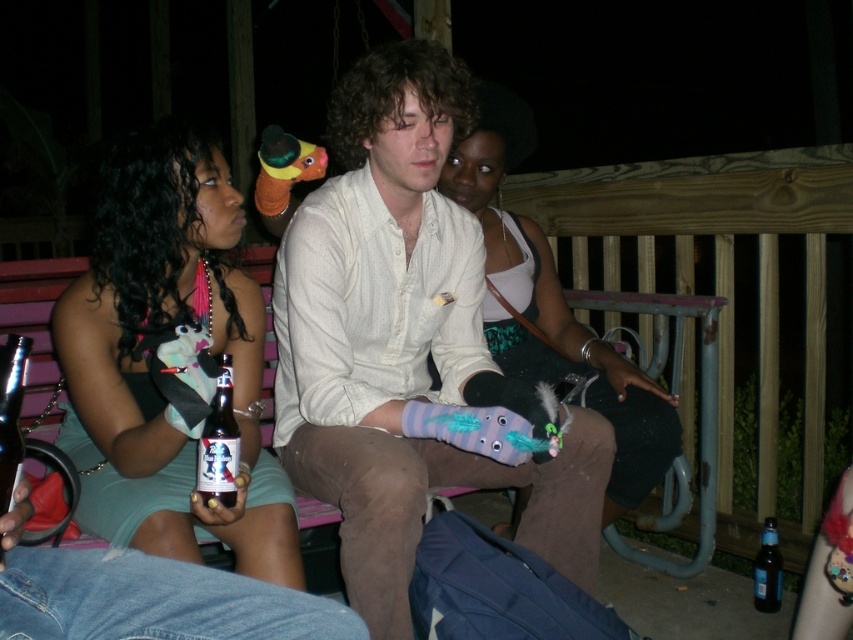
Question: Among these points, which one is farthest from the camera?

Choices:
 (A) (773, 611)
 (B) (563, 353)
 (C) (215, 465)

Answer: (B)

Question: Among these objects, which one is farthest from the camera?

Choices:
 (A) brown glass bottle at lower left
 (B) dark blue glass bottle at lower right
 (C) matte black dress at center

Answer: (B)

Question: Is matte black dress at center wider than matte purple plush toy at center?

Choices:
 (A) yes
 (B) no

Answer: (A)

Question: Which of the following is the closest to the observer?

Choices:
 (A) (131, 333)
 (B) (659, 392)
 (C) (209, 483)

Answer: (C)

Question: Observing the image, what is the correct spatial positioning of white cotton shirt at center in reference to matte black dress at center?

Choices:
 (A) above
 (B) below

Answer: (A)

Question: In this image, where is white cotton shirt at center located relative to brown glass bottle at lower left?

Choices:
 (A) right
 (B) left

Answer: (A)